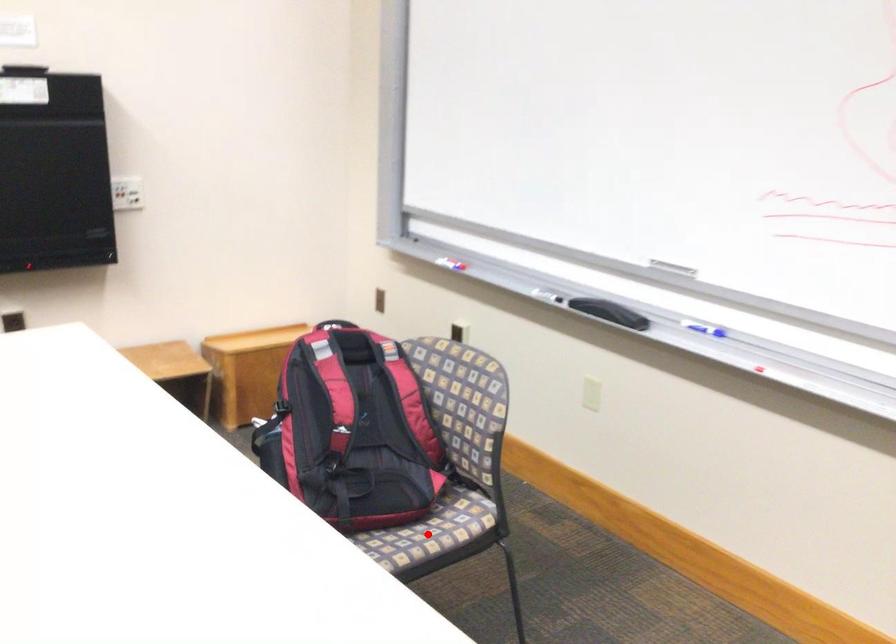
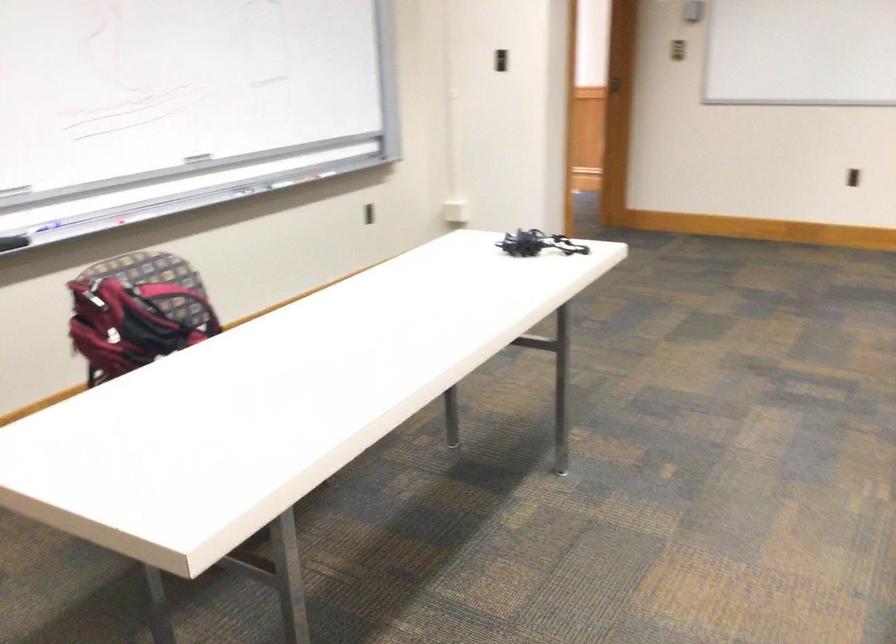
Question: I am providing you with two images of the same scene from different viewpoints. A red point is marked on the first image. At the location where the point appears in image 1, is it still visible in image 2?

Choices:
 (A) Yes
 (B) No

Answer: (B)